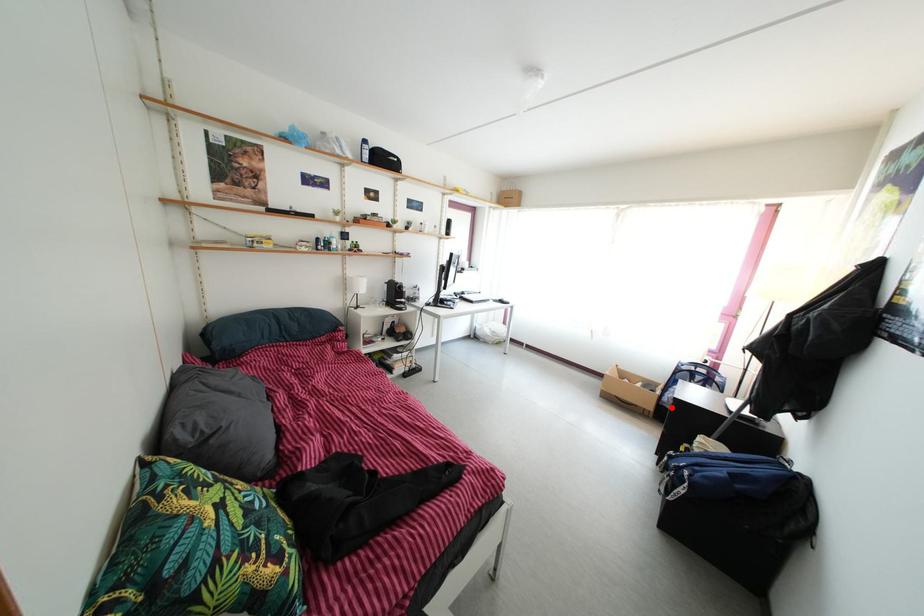
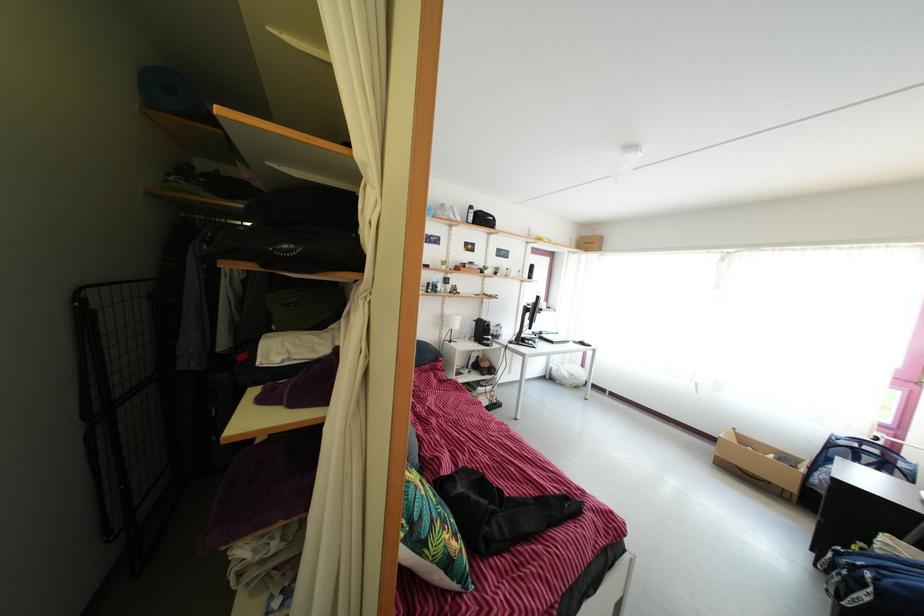
In the second image, find the point that corresponds to the highlighted location in the first image.

(821, 488)